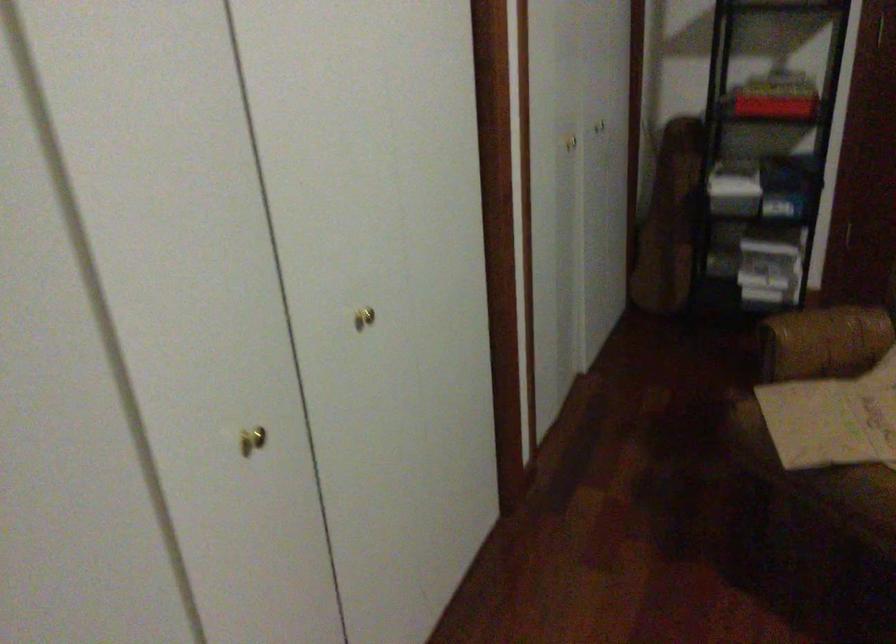
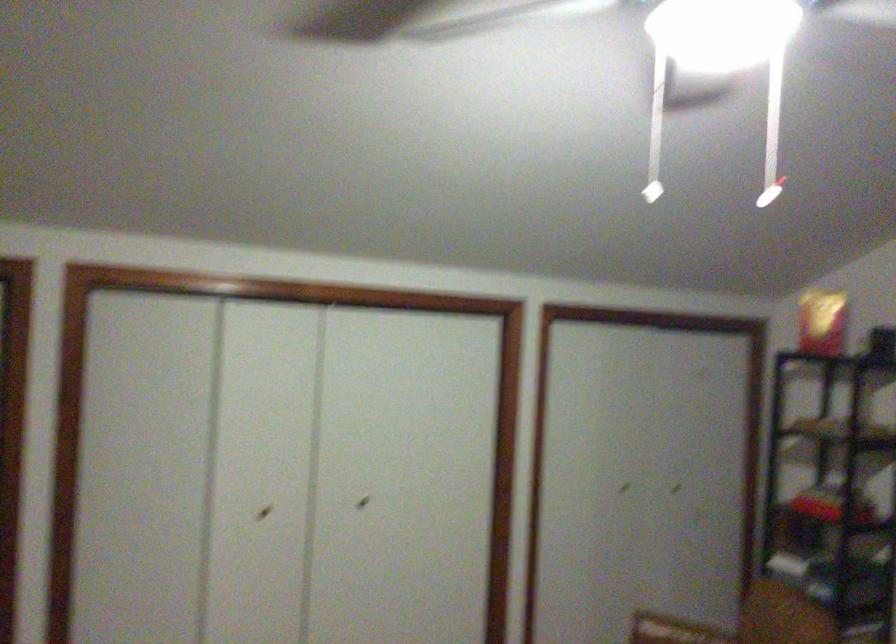
The point at (362, 313) is marked in the first image. Where is the corresponding point in the second image?

(363, 502)